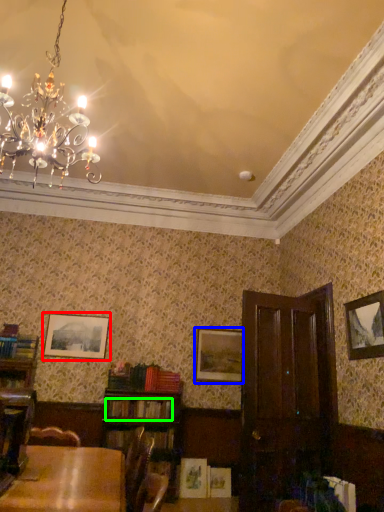
Question: Considering the real-world distances, which object is farthest from picture frame (highlighted by a red box)? picture frame (highlighted by a blue box) or book (highlighted by a green box)?

Choices:
 (A) picture frame
 (B) book

Answer: (B)